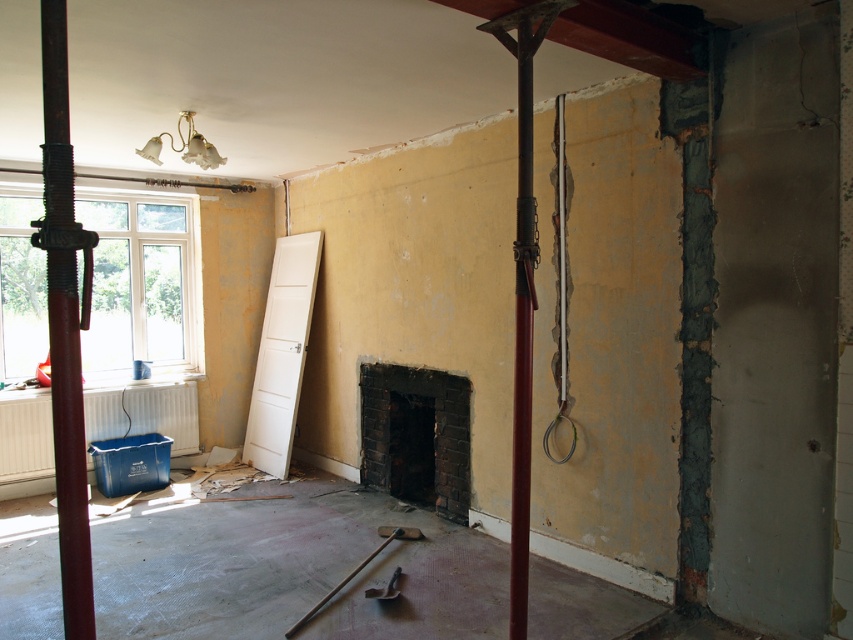
You are standing in the room and want to place a small potted plant exactly at point (x=416, y=435). What object will be at that location?

The black brick fireplace at center is located at point (x=416, y=435), so placing the potted plant there would place it directly on top of the black brick fireplace at center.

You are a construction worker who needs to move the metallic silver hammer at center to the right side of the rusty metal pole at left. Is this possible based on their current positions?

The rusty metal pole at left is positioned on the left side of metallic silver hammer at center. To move the metallic silver hammer at center to the right side of the rusty metal pole at left would require moving it past the pole to its right, which is feasible as their positions are not fixed in the scene description.